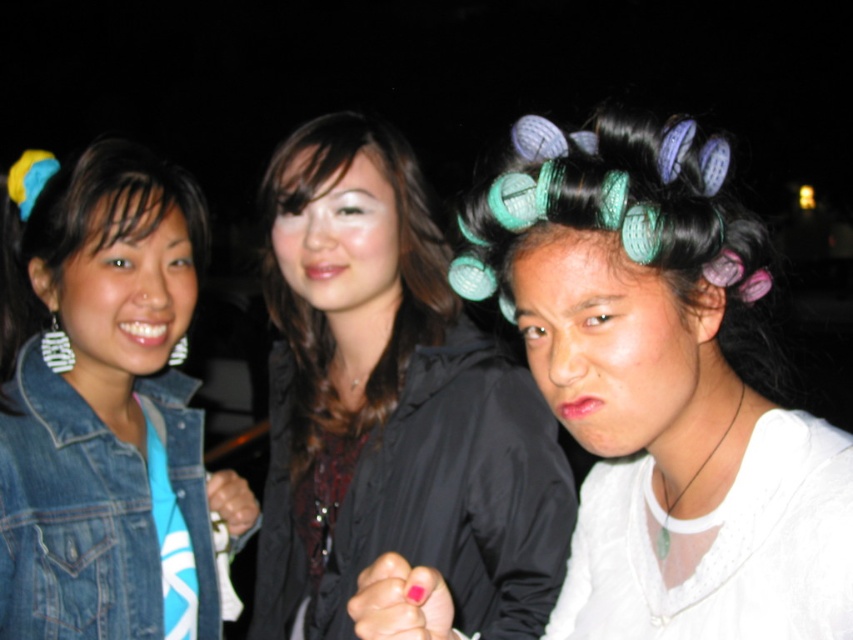
You are a photographer who wants to capture a clear shot of both the teal plastic hair rollers at center and the black matte hair at left. Based on their positions, which object should you focus on first to ensure both are in frame?

The teal plastic hair rollers at center is positioned on the right side of black matte hair at left, so you should focus on the black matte hair at left first to ensure both are in frame.

Looking at this image, you are a photographer who wants to ensure that both the teal plastic hair rollers at center and the teal plastic curlers at center are clearly visible in your photo. Given their sizes, which one might you need to adjust your focus on more carefully to avoid blurriness?

The teal plastic hair rollers at center is smaller than the teal plastic curlers at center, so the photographer should focus more carefully on the teal plastic hair rollers at center to avoid blurriness due to its smaller size.